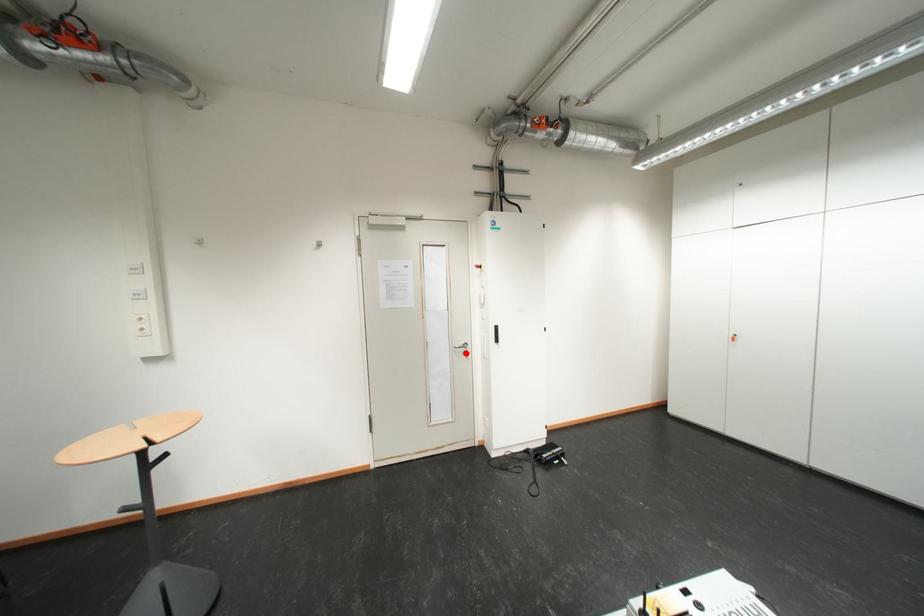
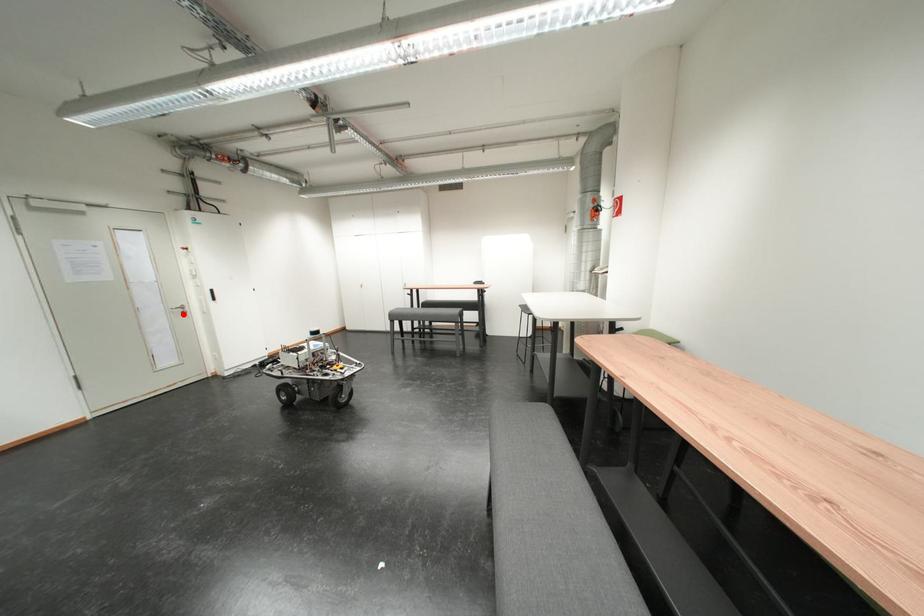
I am providing you with two images of the same scene from different viewpoints. A red point is marked on the first image and another point is marked on the second image. Is the red point in image1 aligned with the point shown in image2?

Yes